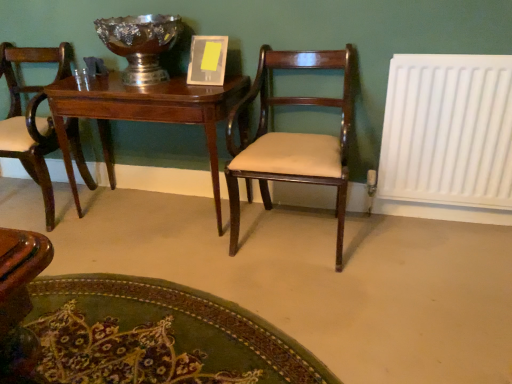
Question: In terms of size, does matte wood chair at left, the first chair positioned from the left, appear bigger or smaller than white plastic radiator at right?

Choices:
 (A) big
 (B) small

Answer: (A)

Question: Considering the positions of point (70, 129) and point (510, 97), is point (70, 129) closer or farther from the camera than point (510, 97)?

Choices:
 (A) closer
 (B) farther

Answer: (B)

Question: Which is nearer to the mahogany wood chair at center, acting as the first chair starting from the right?

Choices:
 (A) white plastic radiator at right
 (B) matte wood chair at left, the first chair positioned from the left
 (C) shiny silver bowl at upper center
 (D) mahogany wood table at center

Answer: (D)

Question: Which object is the closest to the mahogany wood chair at center, which is the 2th chair in left-to-right order?

Choices:
 (A) shiny silver bowl at upper center
 (B) mahogany wood table at center
 (C) matte wood chair at left, marked as the 2th chair in a right-to-left arrangement
 (D) white plastic radiator at right

Answer: (B)